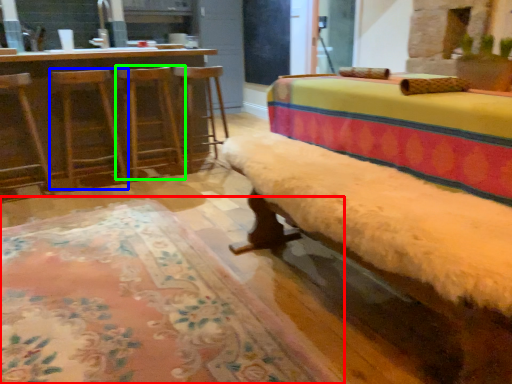
Question: Which object is positioned farthest from mat (highlighted by a red box)? Select from swivel chair (highlighted by a blue box) and bar stool (highlighted by a green box).

Choices:
 (A) swivel chair
 (B) bar stool

Answer: (B)